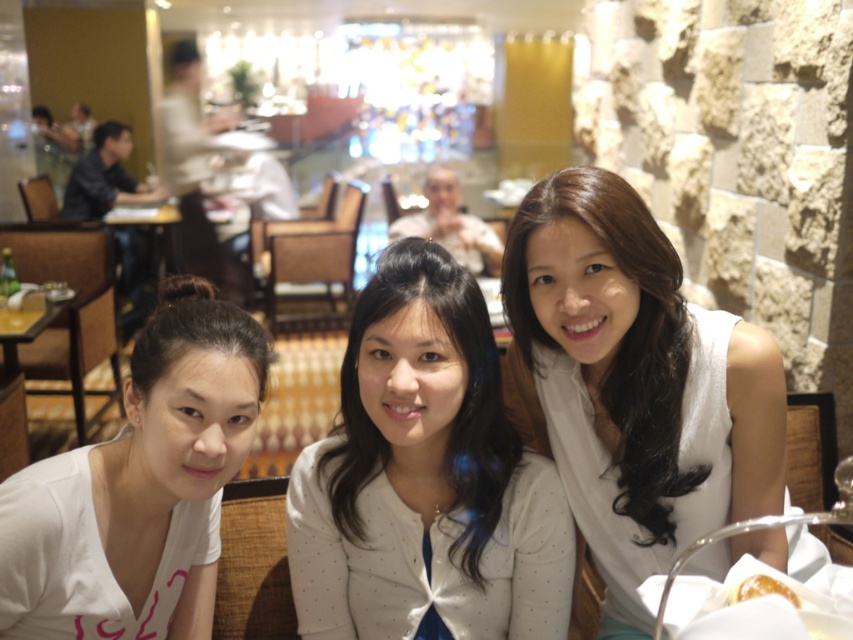
You are a photographer trying to capture a closeup of the white dotted cardigan at center without including the white matte dress at center in the frame. Is this possible given their positions?

The white matte dress at center is above the white dotted cardigan at center, so if you position the camera below the white matte dress at center and aim upwards, you can capture the white dotted cardigan at center without including the dress in the frame.

You are a waiter in a restaurant and need to place a new order for a customer. The customer wants their dish placed between the white matte dress at center and the golden glazed donut at lower right. Can you determine where to place the dish?

The white matte dress at center is positioned on the left side of golden glazed donut at lower right, so the dish should be placed between them, to the right of the white matte dress at center and to the left of the golden glazed donut at lower right.

You are a photographer standing at the edge of the scene. You need to capture a photo where the white matte dress at center and the golden glazed donut at lower right are both clearly visible. Which object should you focus on first to ensure both are in frame?

The white matte dress at center is taller than the golden glazed donut at lower right. To ensure both are in frame, focus on the taller object first, which is the white matte dress at center, as it requires more space vertically.